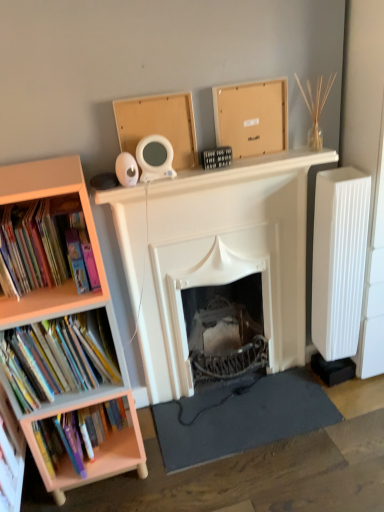
You are a GUI agent. You are given a task and a screenshot of the screen. Output one action in this format:
    pyautogui.click(x=<x>, y=<y>)
    Task: Click on the free space above peach wood bookcase at left (from a real-world perspective)
    
    Given the screenshot: What is the action you would take?
    pyautogui.click(x=27, y=169)